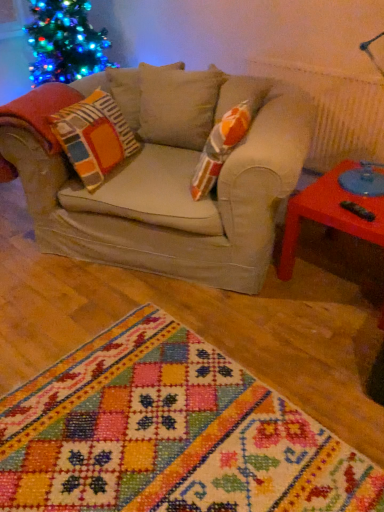
Image resolution: width=384 pixels, height=512 pixels. I want to click on free region under rubberized plastic table at right (from a real-world perspective), so click(x=348, y=282).